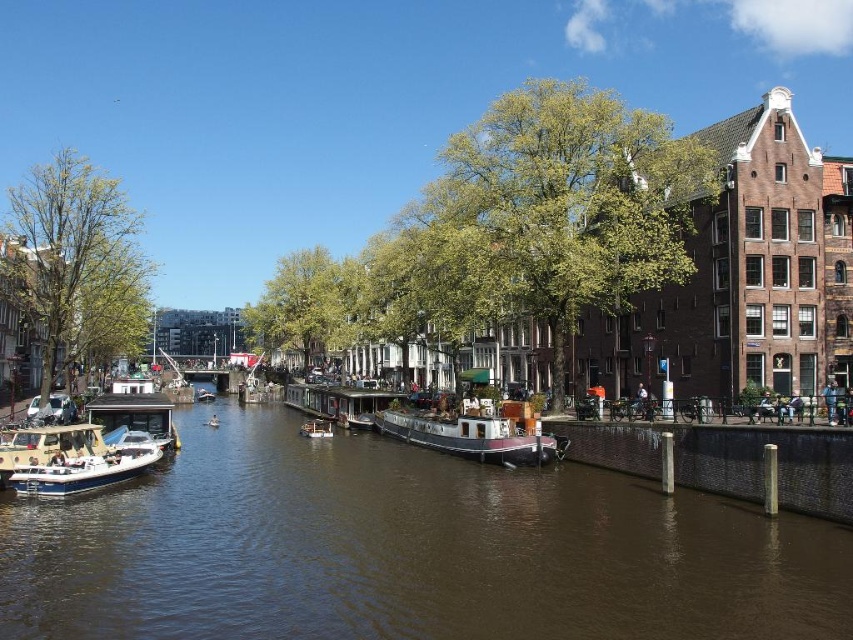
Question: Observing the image, what is the correct spatial positioning of metallic polished boat at center in reference to white glossy houseboat at center?

Choices:
 (A) below
 (B) above

Answer: (B)

Question: Is white glossy houseboat at center thinner than white glossy boat at center?

Choices:
 (A) yes
 (B) no

Answer: (A)

Question: Which point is farther to the camera?

Choices:
 (A) white glossy houseboat at center
 (B) metallic silver boat at center
 (C) white glossy boat at lower left
 (D) white glossy boat at center

Answer: (D)

Question: Among these points, which one is nearest to the camera?

Choices:
 (A) (320, 435)
 (B) (199, 396)
 (C) (128, 456)
 (D) (368, 417)

Answer: (C)

Question: Is white glossy houseboat at center closer to camera compared to metallic silver boat at center?

Choices:
 (A) no
 (B) yes

Answer: (B)

Question: Which point is closer to the camera?

Choices:
 (A) metallic silver boat at center
 (B) white glossy boat at lower left

Answer: (B)